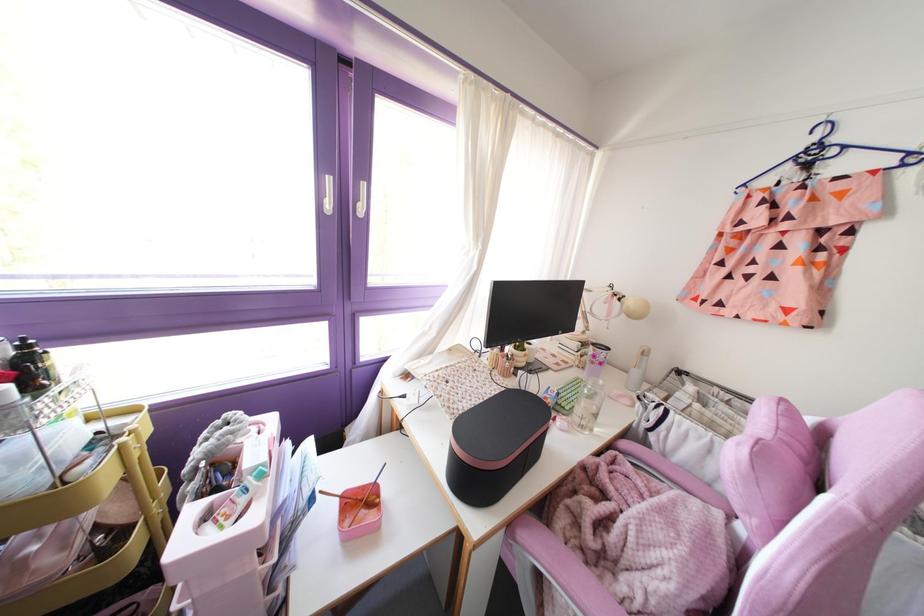
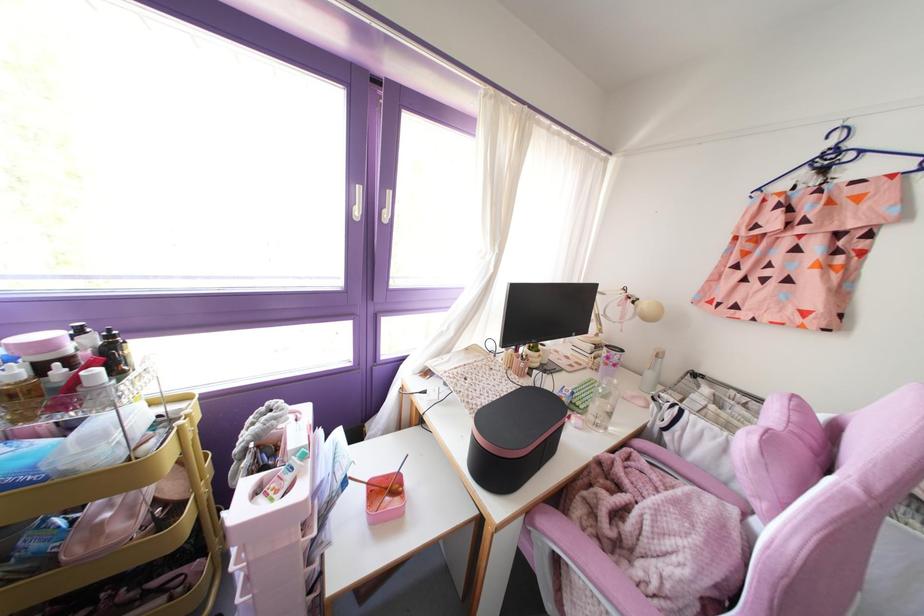
Locate, in the second image, the point that corresponds to (600,363) in the first image.

(614, 365)